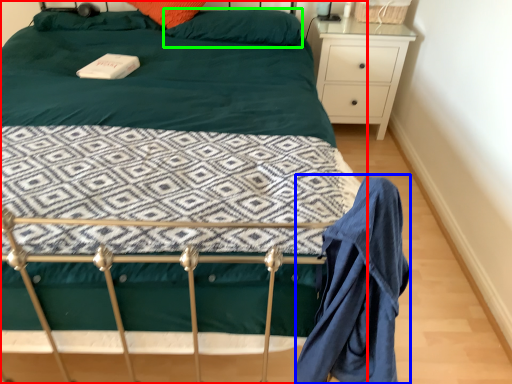
Question: Which is nearer to the bed (highlighted by a red box)? robe (highlighted by a blue box) or pillow (highlighted by a green box).

Choices:
 (A) robe
 (B) pillow

Answer: (A)